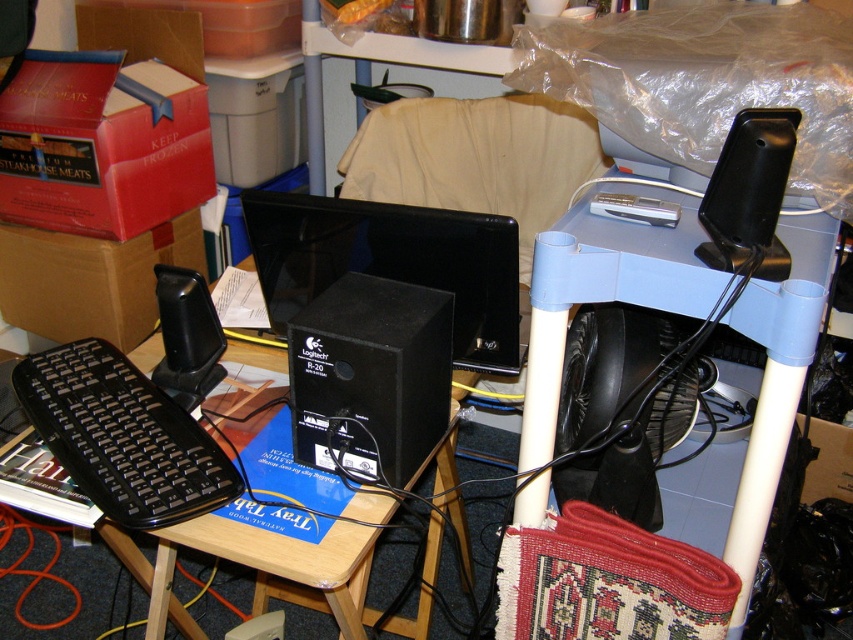
Can you confirm if black glossy monitor at center is positioned to the right of matte cardboard box at left?

Indeed, black glossy monitor at center is positioned on the right side of matte cardboard box at left.

Which is in front, point (352, 266) or point (22, 301)?

Point (352, 266)

Where is `black glossy monitor at center`? Image resolution: width=853 pixels, height=640 pixels. black glossy monitor at center is located at coordinates (392, 262).

Does point (782, 342) come in front of point (57, 433)?

Yes, it is in front of point (57, 433).

Between blue plastic table at center and black plastic keyboard at lower left, which one appears on the left side from the viewer's perspective?

black plastic keyboard at lower left

The image size is (853, 640). What are the coordinates of `blue plastic table at center` in the screenshot? It's located at point(604,291).

Describe the element at coordinates (112, 442) in the screenshot. The image size is (853, 640). I see `black plastic keyboard at lower left` at that location.

Does black plastic keyboard at lower left have a larger size compared to black plastic speaker at upper right?

Yes, black plastic keyboard at lower left is bigger than black plastic speaker at upper right.

Who is more forward, (28,365) or (701,243)?

Point (701,243) is in front.

Locate an element on the screen. black plastic keyboard at lower left is located at coordinates (112, 442).